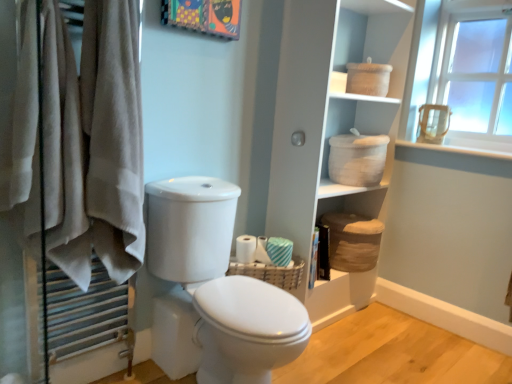
Question: From a real-world perspective, does white striped fabric at right, the 2th toilet paper positioned from the left, stand above white textured toilet paper at center, arranged as the first toilet paper when viewed from the left?

Choices:
 (A) no
 (B) yes

Answer: (B)

Question: From the image's perspective, is white striped fabric at right, acting as the 1th toilet paper starting from the right, on top of white textured toilet paper at center, placed as the 2th toilet paper when sorted from right to left?

Choices:
 (A) no
 (B) yes

Answer: (B)

Question: Does white striped fabric at right, the 2th toilet paper positioned from the left, have a greater width compared to white textured toilet paper at center, placed as the 2th toilet paper when sorted from right to left?

Choices:
 (A) yes
 (B) no

Answer: (A)

Question: Does white striped fabric at right, the 2th toilet paper positioned from the left, have a greater height compared to white textured toilet paper at center, arranged as the first toilet paper when viewed from the left?

Choices:
 (A) no
 (B) yes

Answer: (A)

Question: Could white textured toilet paper at center, placed as the 2th toilet paper when sorted from right to left, be considered to be inside white striped fabric at right, the 2th toilet paper positioned from the left?

Choices:
 (A) yes
 (B) no

Answer: (B)

Question: From the image's perspective, is white glossy toilet at center positioned above or below white woven baskets at upper center?

Choices:
 (A) below
 (B) above

Answer: (A)

Question: Looking at their shapes, would you say white glossy toilet at center is wider or thinner than white woven baskets at upper center?

Choices:
 (A) wide
 (B) thin

Answer: (A)

Question: Considering the positions of point (156, 314) and point (303, 117), is point (156, 314) closer or farther from the camera than point (303, 117)?

Choices:
 (A) closer
 (B) farther

Answer: (A)

Question: Is white glossy toilet at center in front of or behind white woven baskets at upper center in the image?

Choices:
 (A) front
 (B) behind

Answer: (A)

Question: Do you think white woven baskets at upper center is within brown woven basket at lower center, the second basket in the front-to-back sequence, or outside of it?

Choices:
 (A) inside
 (B) outside

Answer: (B)

Question: Is point (296, 14) positioned closer to the camera than point (330, 215)?

Choices:
 (A) closer
 (B) farther

Answer: (A)

Question: From the image's perspective, is white woven baskets at upper center above or below brown woven basket at lower center, acting as the 1th basket starting from the right?

Choices:
 (A) above
 (B) below

Answer: (A)

Question: Considering the relative positions of white woven baskets at upper center and brown woven basket at lower center, the second basket in the front-to-back sequence, in the image provided, is white woven baskets at upper center to the left or to the right of brown woven basket at lower center, the second basket in the front-to-back sequence,?

Choices:
 (A) right
 (B) left

Answer: (B)

Question: Relative to white textured toilet paper at center, arranged as the first toilet paper when viewed from the left, is white woven baskets at upper center in front or behind?

Choices:
 (A) behind
 (B) front

Answer: (B)

Question: From the image's perspective, is white woven baskets at upper center above or below white textured toilet paper at center, placed as the 2th toilet paper when sorted from right to left?

Choices:
 (A) below
 (B) above

Answer: (B)